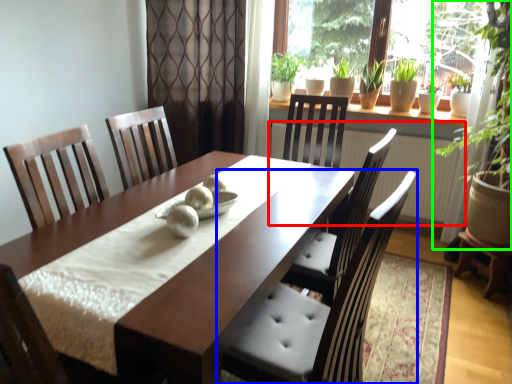
Question: Which object is positioned farthest from radiator (highlighted by a red box)? Select from chair (highlighted by a blue box) and houseplant (highlighted by a green box).

Choices:
 (A) chair
 (B) houseplant

Answer: (A)